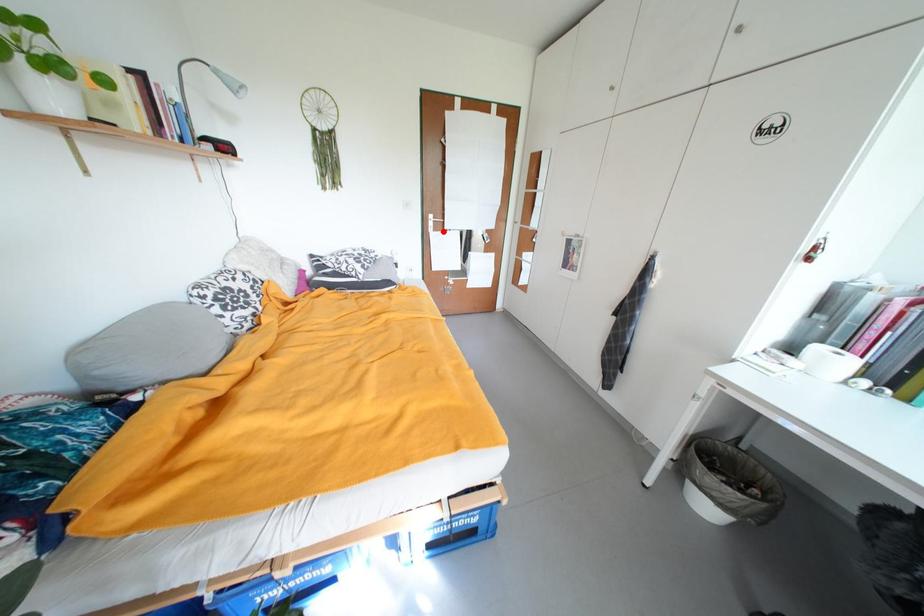
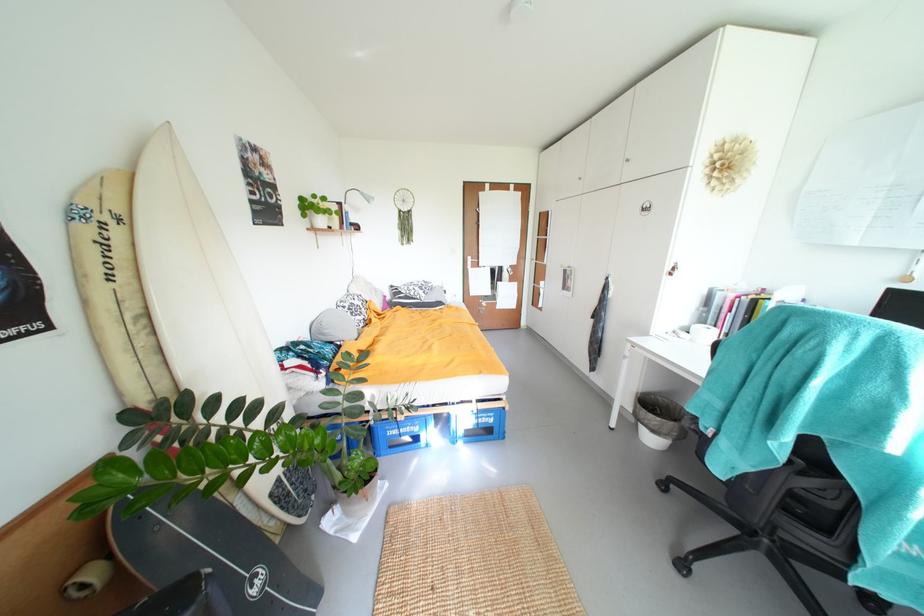
Question: I am providing you with two images of the same scene from different viewpoints. In image1, a red point is highlighted. Considering the same 3D point in image2, which of the following is correct?

Choices:
 (A) It is closer
 (B) It is farther

Answer: (B)